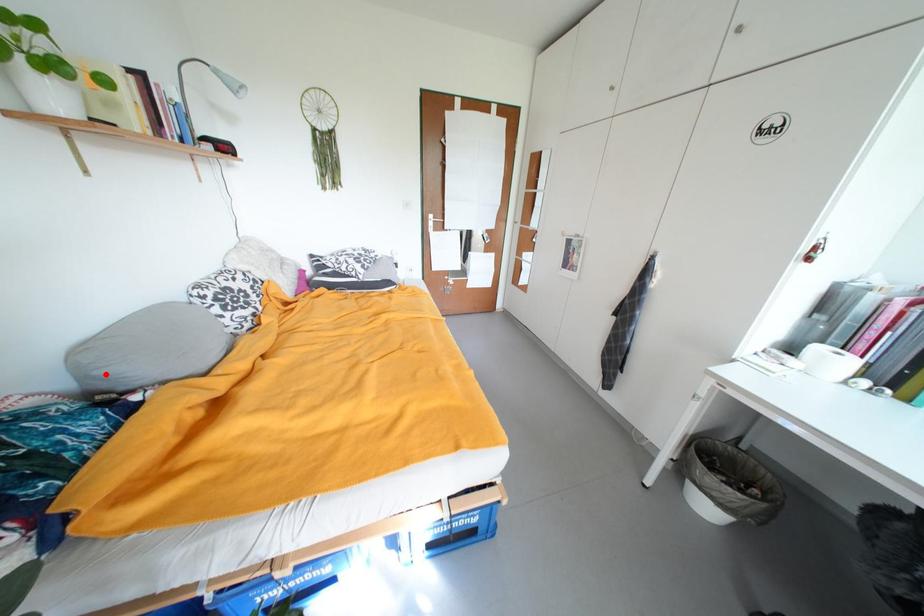
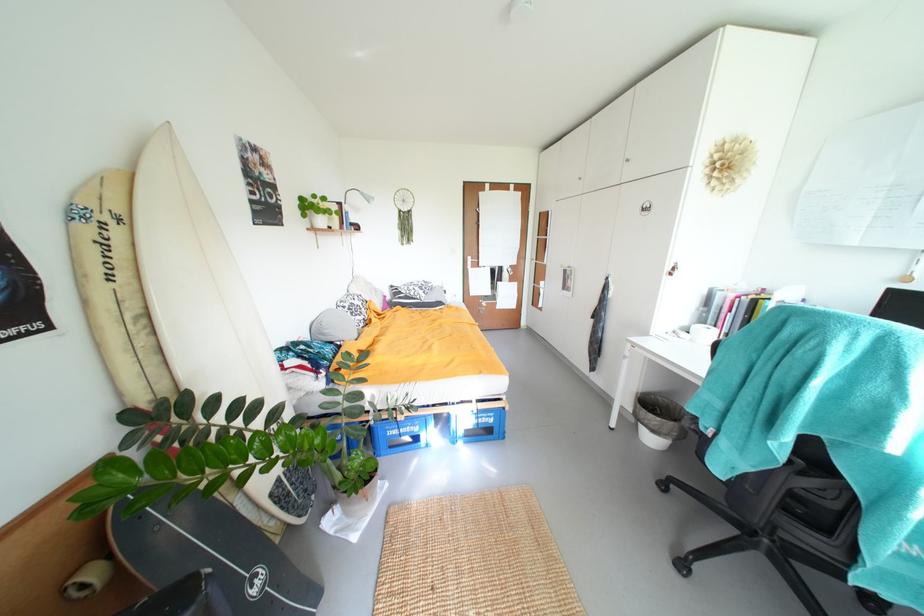
Where in the second image is the point corresponding to the highlighted location from the first image?

(333, 333)